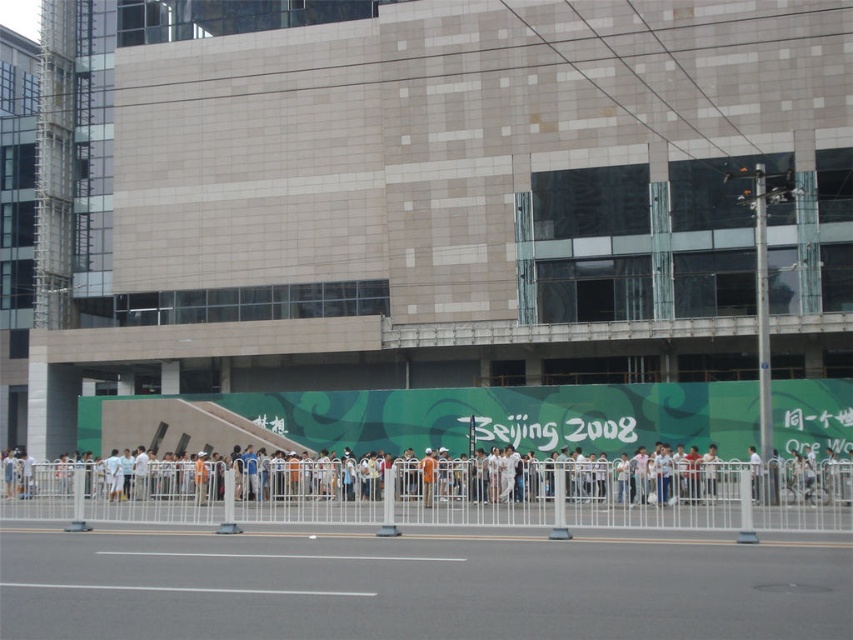
Which is more to the right, white metal fence at center or transparent plastic line at center?

Positioned to the right is transparent plastic line at center.

Locate an element on the screen. This screenshot has height=640, width=853. white metal fence at center is located at coordinates (456, 497).

Does point (364, 499) come farther from viewer compared to point (96, 552)?

Yes, it is.

You are a GUI agent. You are given a task and a screenshot of the screen. Output one action in this format:
    pyautogui.click(x=<x>, y=<y>)
    Task: Click on the white metal fence at center
    
    Given the screenshot: What is the action you would take?
    pyautogui.click(x=456, y=497)

Is white glossy line at center taller than transparent plastic line at center?

Yes, white glossy line at center is taller than transparent plastic line at center.

Which is more to the right, white glossy line at center or transparent plastic line at center?

transparent plastic line at center is more to the right.

Who is more forward, [57,582] or [173,552]?

Point [57,582]

Where is `white glossy line at center`? white glossy line at center is located at coordinates (186, 589).

Which of these two, white metal fence at center or white glossy line at center, stands taller?

white metal fence at center

Which is more to the left, white metal fence at center or white glossy line at center?

white metal fence at center

In order to click on white metal fence at center in this screenshot , I will do `click(456, 497)`.